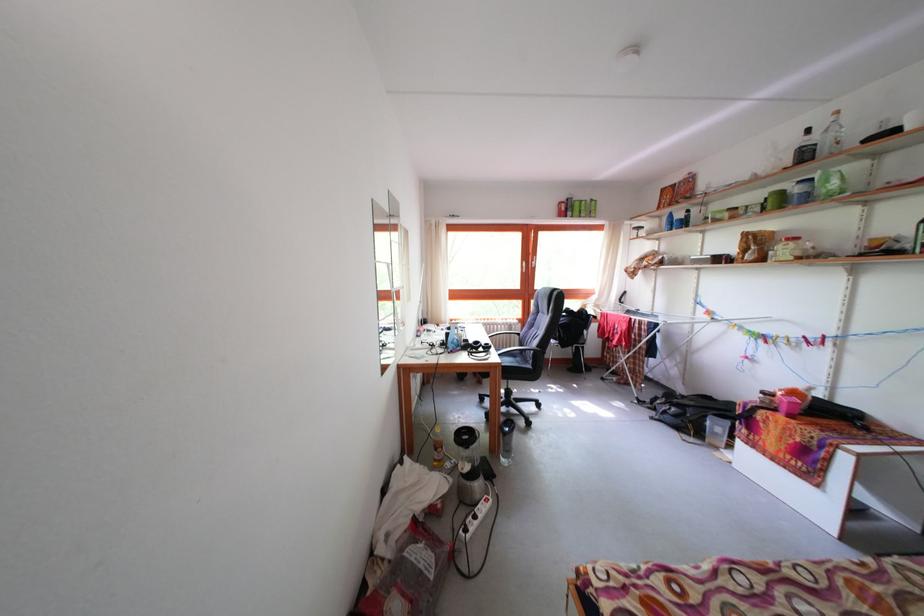
Find where to lift the blue spray bottle. Please return your answer as a coordinate pair (x, y).

(669, 222)